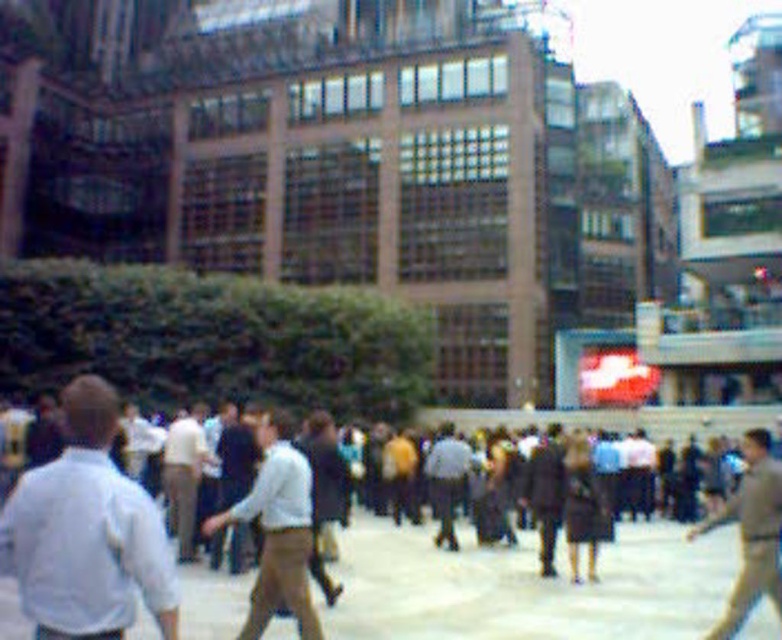
Which is above, light brown leather pants at center or light blue shirt at center?

light blue shirt at center is above.

Who is lower down, light brown leather pants at center or light blue shirt at center?

Positioned lower is light brown leather pants at center.

This screenshot has height=640, width=782. What are the coordinates of `light brown leather pants at center` in the screenshot? It's located at (277, 531).

Between brown fabric crowd at center and light beige pants at center, which one has less height?

light beige pants at center

Is point (522, 602) positioned before point (183, 508)?

Yes.

Between point (180, 611) and point (183, 433), which one is positioned behind?

Positioned behind is point (183, 433).

I want to click on brown fabric crowd at center, so click(526, 588).

In the scene shown: Does light blue shirt at left have a greater width compared to light blue shirt at center?

Correct, the width of light blue shirt at left exceeds that of light blue shirt at center.

Is point (5, 524) behind point (457, 456)?

No, it is not.

Where is `light blue shirt at left`? The image size is (782, 640). light blue shirt at left is located at coordinates (85, 532).